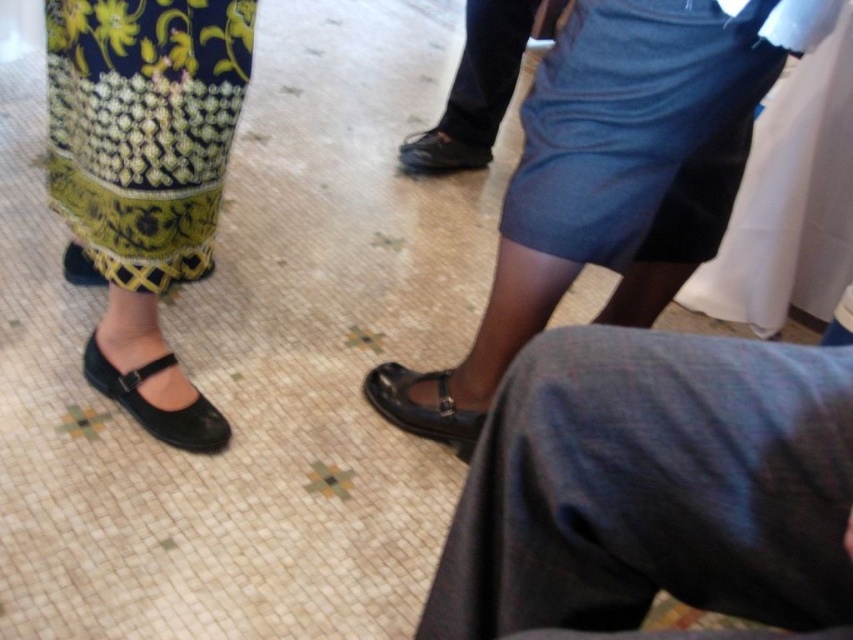
Describe the element at coordinates (637, 131) in the screenshot. I see `blue denim skirt at upper center` at that location.

From the picture: Can you confirm if blue denim skirt at upper center is positioned to the right of black leather shoe at center?

Yes, blue denim skirt at upper center is to the right of black leather shoe at center.

Is point (653, 90) farther from viewer compared to point (379, 374)?

That is False.

Find the location of a particular element. The width and height of the screenshot is (853, 640). blue denim skirt at upper center is located at coordinates (637, 131).

Is point (544, 580) behind point (438, 401)?

That is False.

Looking at this image, is dark blue fabric pants at lower right smaller than black leather shoe at center?

No, dark blue fabric pants at lower right is not smaller than black leather shoe at center.

The width and height of the screenshot is (853, 640). Find the location of `dark blue fabric pants at lower right`. dark blue fabric pants at lower right is located at coordinates (653, 492).

Can you confirm if dark blue fabric pants at lower right is positioned below black leather sandal at lower left?

Yes.

Does point (498, 544) come closer to viewer compared to point (102, 358)?

Yes, point (498, 544) is closer to viewer.

Identify the location of dark blue fabric pants at lower right. The width and height of the screenshot is (853, 640). (653, 492).